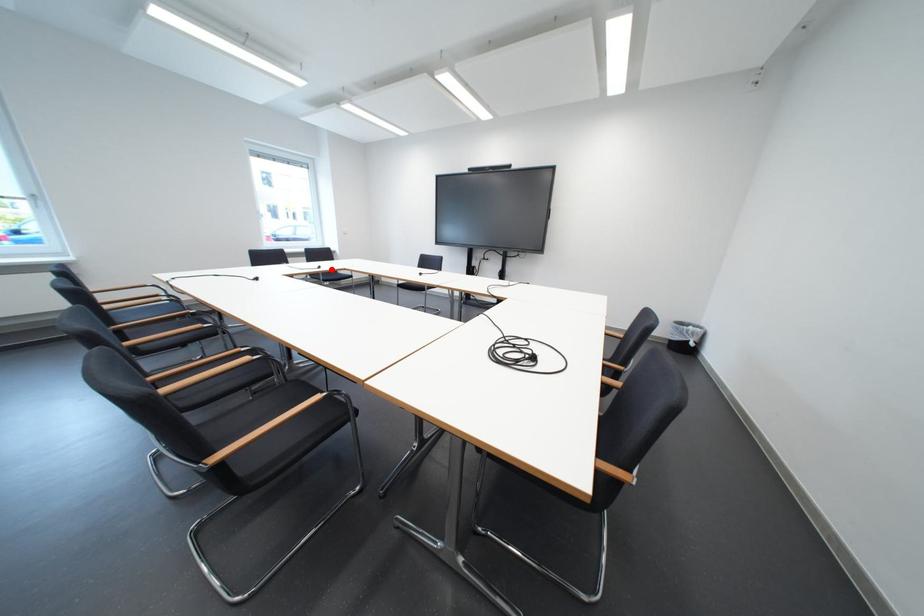
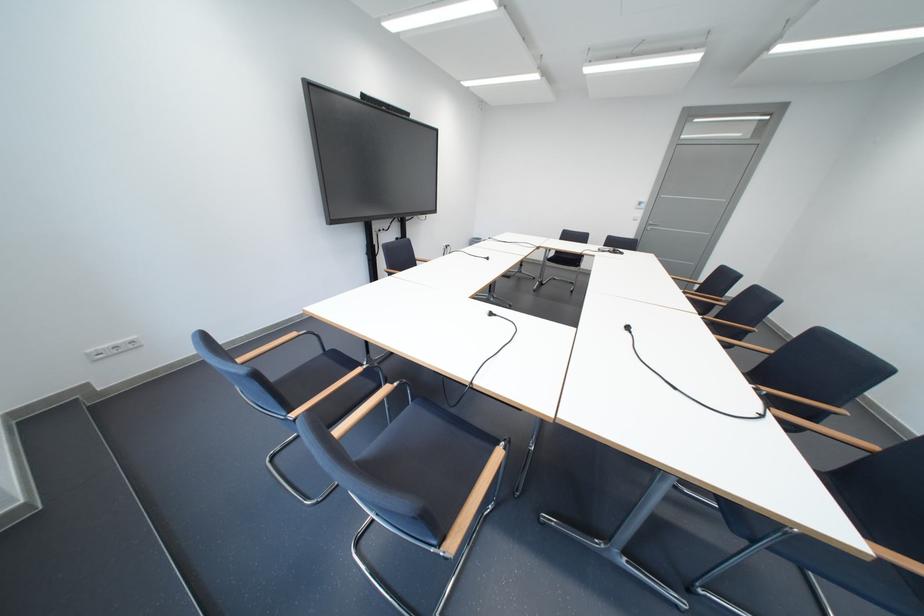
Question: A red point is marked in image1. In image2, is the corresponding 3D point closer to the camera or farther? Reply with the corresponding letter.

Choices:
 (A) The corresponding 3D point is closer.
 (B) The corresponding 3D point is farther.

Answer: (B)